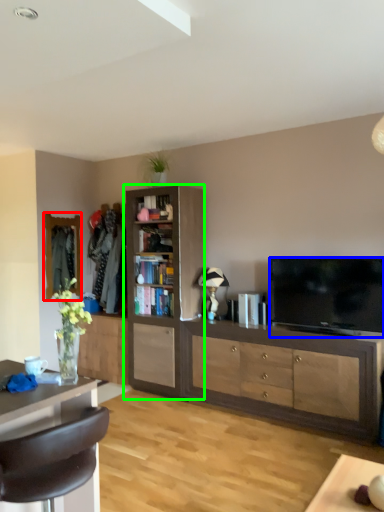
Question: Which object is positioned closest to mirror (highlighted by a red box)? Select from television (highlighted by a blue box) and cabinetry (highlighted by a green box).

Choices:
 (A) television
 (B) cabinetry

Answer: (B)